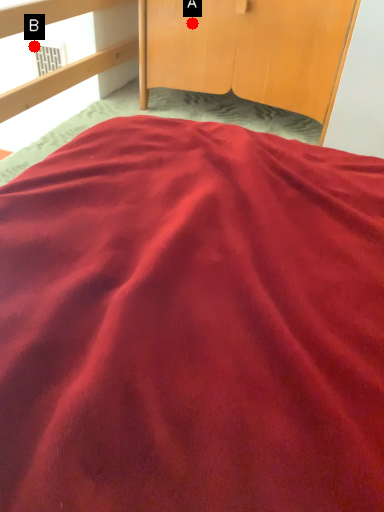
Question: Two points are circled on the image, labeled by A and B beside each circle. Which point appears farthest from the camera in this image?

Choices:
 (A) A is further
 (B) B is further

Answer: (B)